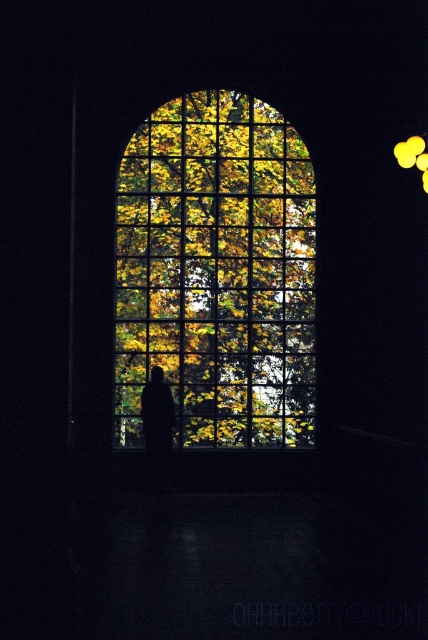
You are an interior designer trying to place a large painting on the wall behind the translucent glass window at center. The painting is 1.5 meters wide. Can you determine if there is enough space to hang it without overlapping the window?

The translucent glass window at center is located at point (216,273) in 2D space. Since the painting is 1.5 meters wide, we need to know the window width to determine if there is enough space. However, the provided information does not specify the window dimensions. Without this data, it is impossible to confirm if the painting will fit without overlapping the window.

You are standing in a dark room looking through an arched window with a grid pattern. You notice two points marked on the window glass at coordinates point (187, 179) and point (412, 145). Which point is closer to you as you face the window?

Point (412, 145) is closer to you because point (187, 179) is behind it.